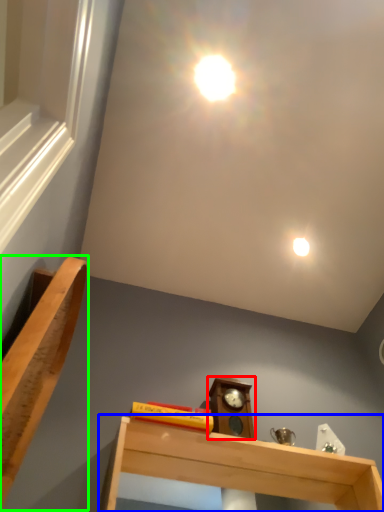
Question: Which object is the closest to the alarm clock (highlighted by a red box)? Choose among these: shelf (highlighted by a blue box) or furniture (highlighted by a green box).

Choices:
 (A) shelf
 (B) furniture

Answer: (A)